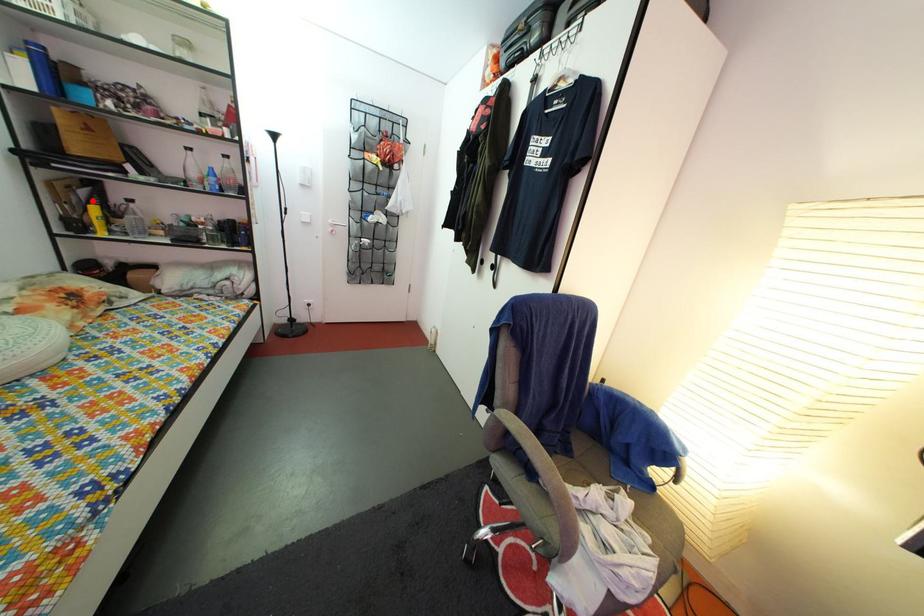
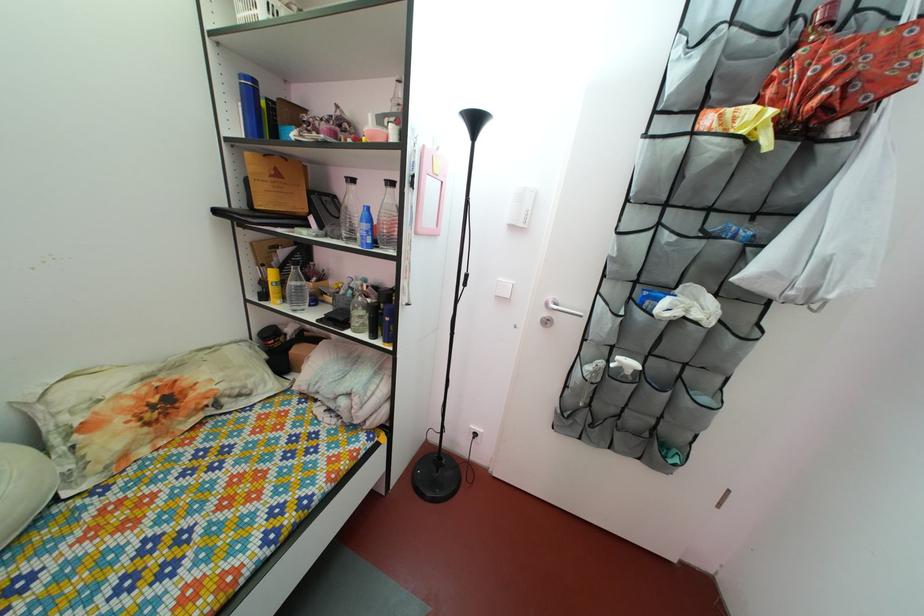
The point at the highlighted location is marked in the first image. Where is the corresponding point in the second image?

(292, 262)